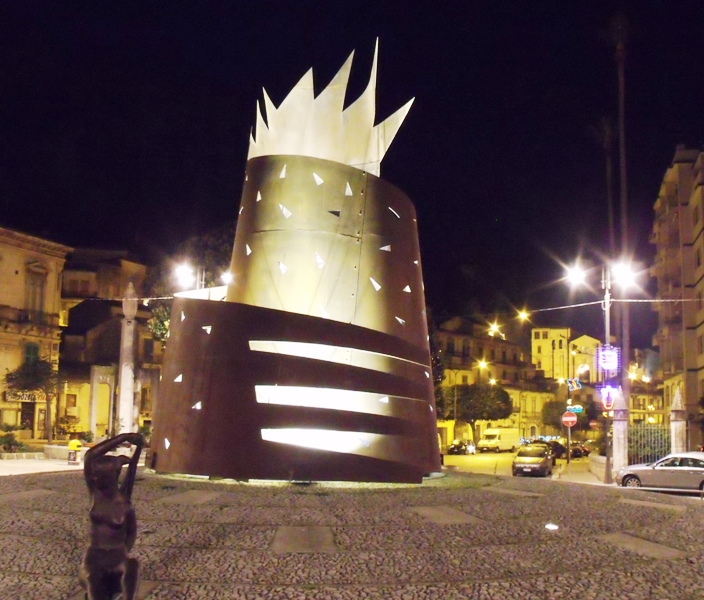
The width and height of the screenshot is (704, 600). What are the coordinates of `ground light` in the screenshot? It's located at (551, 526).